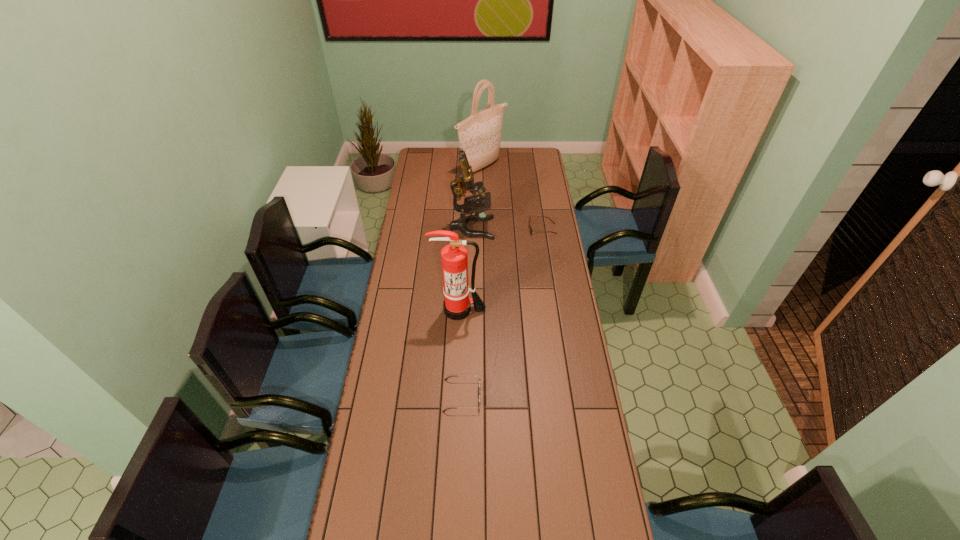
At what (x,y) coordinates should I click in order to perform the action: click on the tallest object. Please return your answer as a coordinate pair (x, y). Looking at the image, I should click on (479, 135).

Locate an element on the screen. This screenshot has height=540, width=960. shopping bag is located at coordinates coord(479,135).

You are a GUI agent. You are given a task and a screenshot of the screen. Output one action in this format:
    pyautogui.click(x=<x>, y=<y>)
    Task: Click on the microscope
    The image size is (960, 540).
    Given the screenshot: What is the action you would take?
    pyautogui.click(x=464, y=181)

The height and width of the screenshot is (540, 960). I want to click on the second nearest object, so click(457, 305).

You are a GUI agent. You are given a task and a screenshot of the screen. Output one action in this format:
    pyautogui.click(x=<x>, y=<y>)
    Task: Click on the farther sunglasses
    The width and height of the screenshot is (960, 540).
    Given the screenshot: What is the action you would take?
    pyautogui.click(x=530, y=228)

Image resolution: width=960 pixels, height=540 pixels. Find the location of `the rightmost object`. the rightmost object is located at coordinates (530, 228).

Locate an element on the screen. the nearer sunglasses is located at coordinates (449, 376).

Locate an element on the screen. The height and width of the screenshot is (540, 960). the left sunglasses is located at coordinates (449, 376).

The width and height of the screenshot is (960, 540). Find the location of `free point located on the right of the shopping bag`. free point located on the right of the shopping bag is located at coordinates (517, 167).

Identify the location of free location located 0.280m at the eyepieces of the microscope. The height and width of the screenshot is (540, 960). (551, 228).